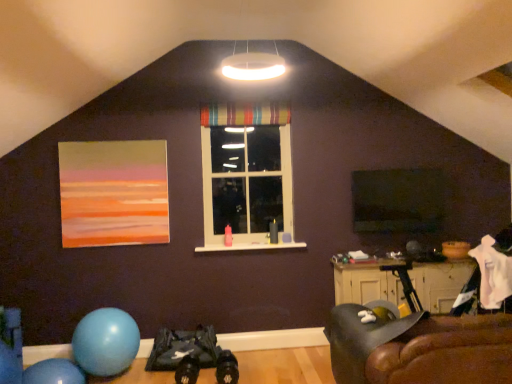
I want to click on vacant area on top of matte acrylic painting at upper left (from a real-world perspective), so click(114, 137).